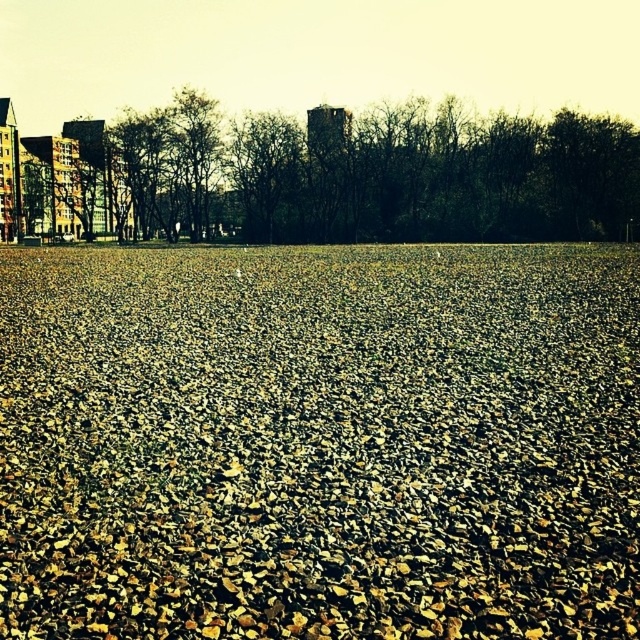
You are a gardener planning to plant a new tree in the brown gravel at center. The brown leafless tree at center is an existing tree in the area. Considering the space between them, will the new tree have enough room to grow without encroaching on the existing tree?

The brown gravel at center has a width less than the brown leafless tree at center, so the new tree may not have enough space to grow without encroaching on the existing tree.

You are standing on the brown gravel at center and looking towards the brown leafless tree at center. Which object takes up more visual space in your view?

The brown leafless tree at center occupies more visual space than the brown gravel at center.

You are standing on the gravel area and want to walk towards the buildings in the background. Which point, point (497, 436) or point (576, 200), would you reach first if you walk straight ahead?

Point (497, 436) is closer to the viewer than point (576, 200), so you would reach point (497, 436) first.